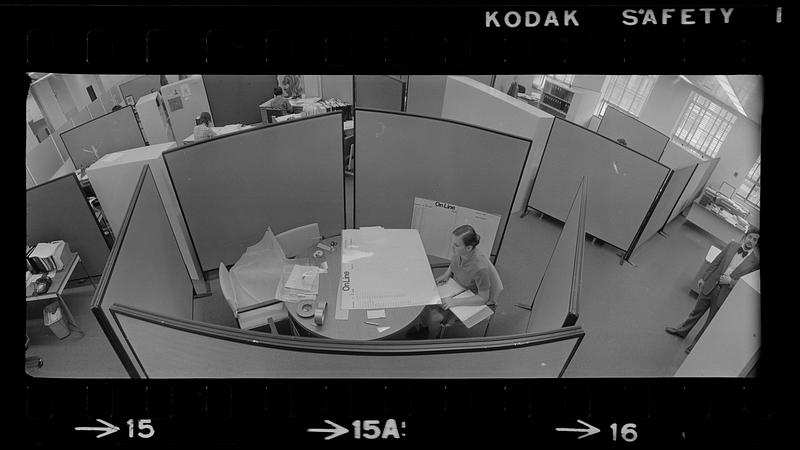
The height and width of the screenshot is (450, 800). I want to click on trash, so click(58, 325).